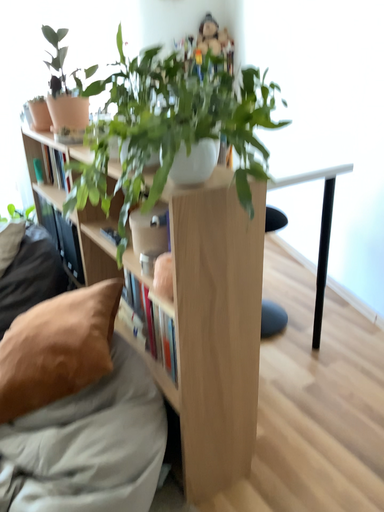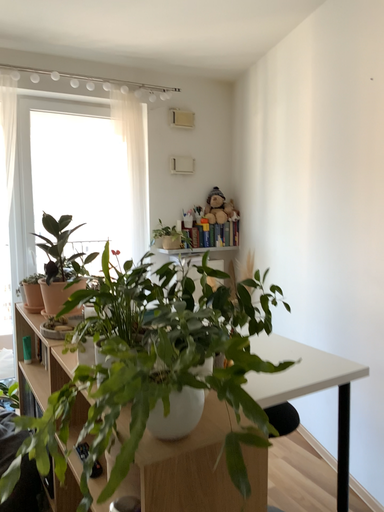
Question: How did the camera likely rotate when shooting the video?

Choices:
 (A) rotated upward
 (B) rotated downward

Answer: (A)